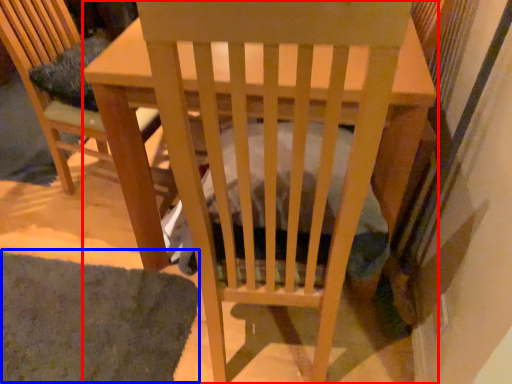
Question: Which point is further to the camera, table (highlighted by a red box) or mat (highlighted by a blue box)?

Choices:
 (A) table
 (B) mat

Answer: (B)